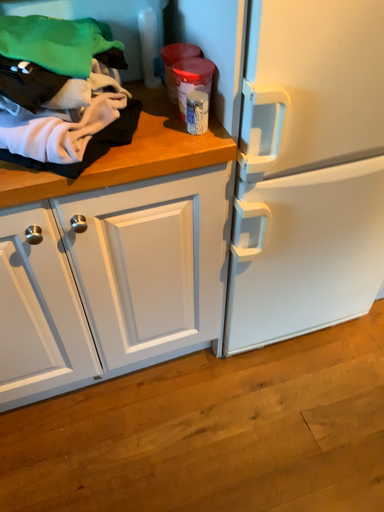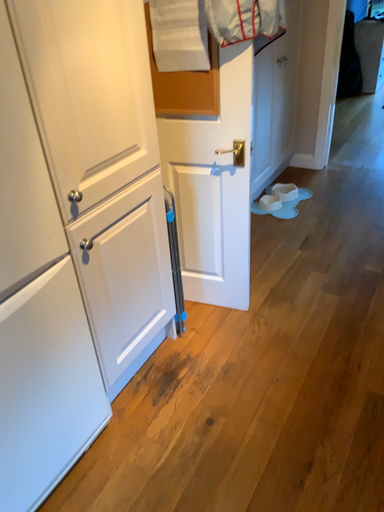
Question: How did the camera likely rotate when shooting the video?

Choices:
 (A) rotated upward
 (B) rotated downward

Answer: (A)